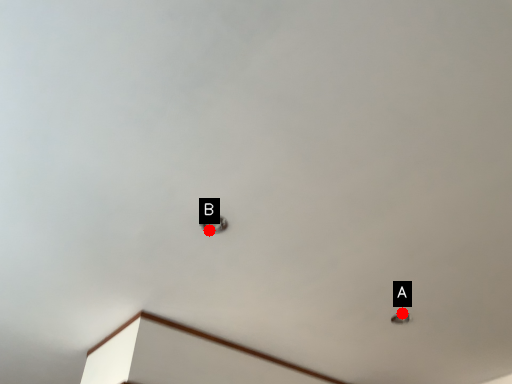
Question: Two points are circled on the image, labeled by A and B beside each circle. Which of the following is the closest to the observer?

Choices:
 (A) A is closer
 (B) B is closer

Answer: (B)